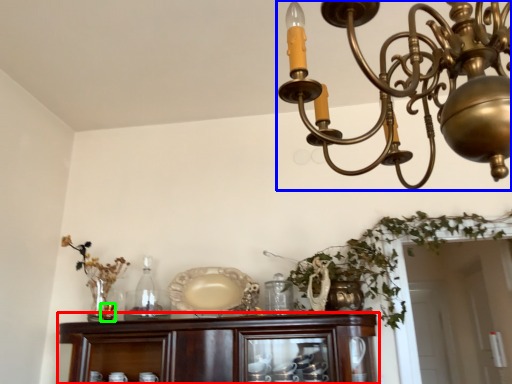
Question: Which object is the closest to the cabinetry (highlighted by a red box)? Choose among these: lamp (highlighted by a blue box) or candle holder (highlighted by a green box).

Choices:
 (A) lamp
 (B) candle holder

Answer: (B)